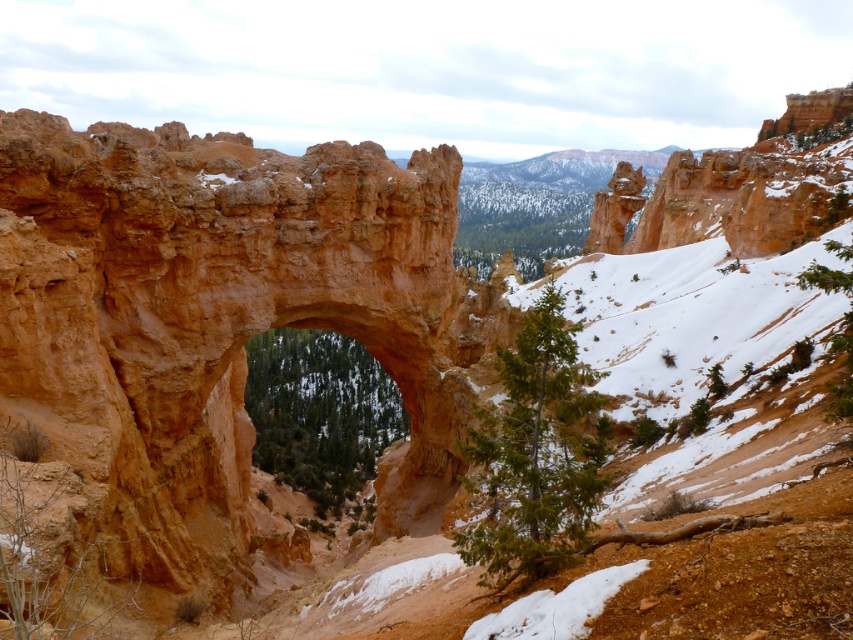
Can you confirm if green textured tree at center is taller than green matte tree at center?

No.

Which is behind, point (543, 308) or point (350, 432)?

The point (350, 432) is behind.

Is point (485, 465) positioned before point (268, 387)?

Yes, it is in front of point (268, 387).

Where is `green textured tree at center`? green textured tree at center is located at coordinates (537, 452).

Between green textured tree at center and green textured tree at lower right, which one appears on the right side from the viewer's perspective?

green textured tree at lower right

Does green textured tree at center appear on the right side of green textured tree at lower right?

In fact, green textured tree at center is to the left of green textured tree at lower right.

Who is more forward, (529, 445) or (834, 340)?

Point (529, 445)

Where is `green textured tree at center`? green textured tree at center is located at coordinates (537, 452).

Can you confirm if green matte tree at center is taller than green textured tree at lower right?

Correct, green matte tree at center is much taller as green textured tree at lower right.

The image size is (853, 640). What are the coordinates of `green matte tree at center` in the screenshot? It's located at (318, 412).